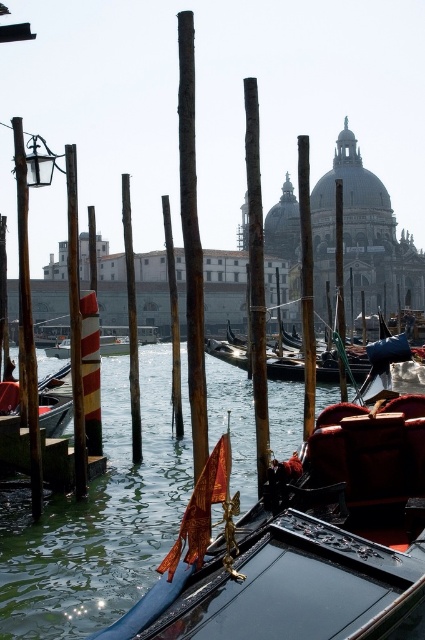
Question: Which point is closer to the camera taking this photo?

Choices:
 (A) (166, 220)
 (B) (385, 483)
 (C) (95, 250)

Answer: (B)

Question: Does wooden gondola at left appear on the left side of orange striped pole at center?

Choices:
 (A) yes
 (B) no

Answer: (B)

Question: Among these points, which one is farthest from the camera?

Choices:
 (A) (68, 364)
 (B) (342, 321)
 (C) (254, 209)

Answer: (A)

Question: Does shiny black gondola at center have a larger size compared to brown wooden pole at center?

Choices:
 (A) no
 (B) yes

Answer: (A)

Question: Estimate the real-world distances between objects in this image. Which object is closer to the wooden gondola at center?

Choices:
 (A) wooden gondola at left
 (B) wooden dock at lower left
 (C) smooth wooden pole at center

Answer: (C)

Question: Does rusty wood pole at center have a greater width compared to orange striped pole at center?

Choices:
 (A) yes
 (B) no

Answer: (B)